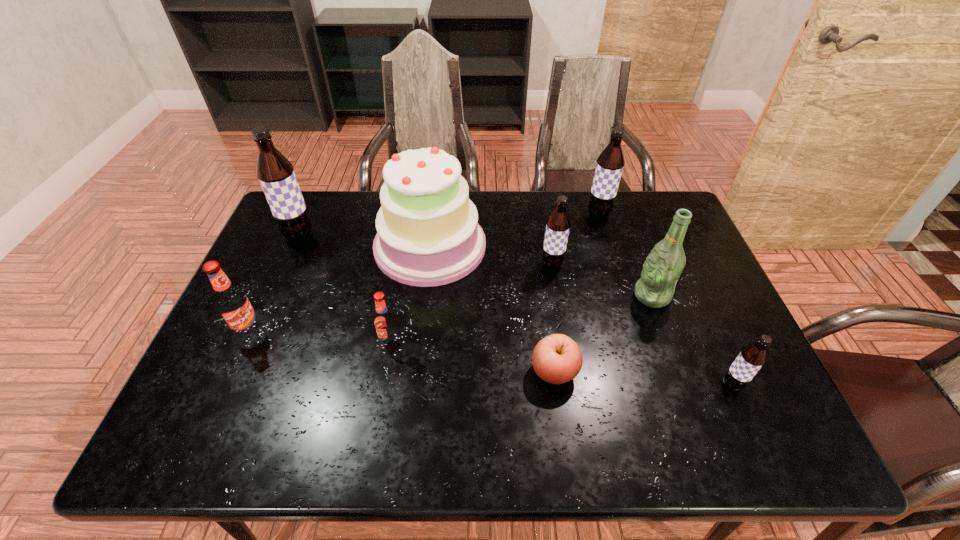
This screenshot has height=540, width=960. I want to click on the third root beer from left to right, so click(384, 320).

You are a GUI agent. You are given a task and a screenshot of the screen. Output one action in this format:
    pyautogui.click(x=<x>, y=<y>)
    Task: Click on the nearest brown root beer
    This screenshot has width=960, height=540.
    Given the screenshot: What is the action you would take?
    pyautogui.click(x=751, y=358)

You are a GUI agent. You are given a task and a screenshot of the screen. Output one action in this format:
    pyautogui.click(x=<x>, y=<y>)
    Task: Click on the rightmost root beer
    The height and width of the screenshot is (540, 960).
    Given the screenshot: What is the action you would take?
    pyautogui.click(x=751, y=358)

Where is `apple`? Image resolution: width=960 pixels, height=540 pixels. apple is located at coordinates (557, 359).

Where is `red apple`? This screenshot has height=540, width=960. red apple is located at coordinates (557, 359).

The image size is (960, 540). Identify the location of free space located on the right of the fifth nearest root beer. (410, 236).

The width and height of the screenshot is (960, 540). What are the coordinates of `blank area located 0.080m on the right of the purple cake` in the screenshot? It's located at (512, 246).

Identify the location of free location located on the left of the third smallest brown root beer. (515, 213).

Image resolution: width=960 pixels, height=540 pixels. In order to click on free space located 0.310m on the surface of the beer bottle in this screenshot , I will do `click(521, 296)`.

I want to click on vacant space located on the surface of the beer bottle, so click(528, 296).